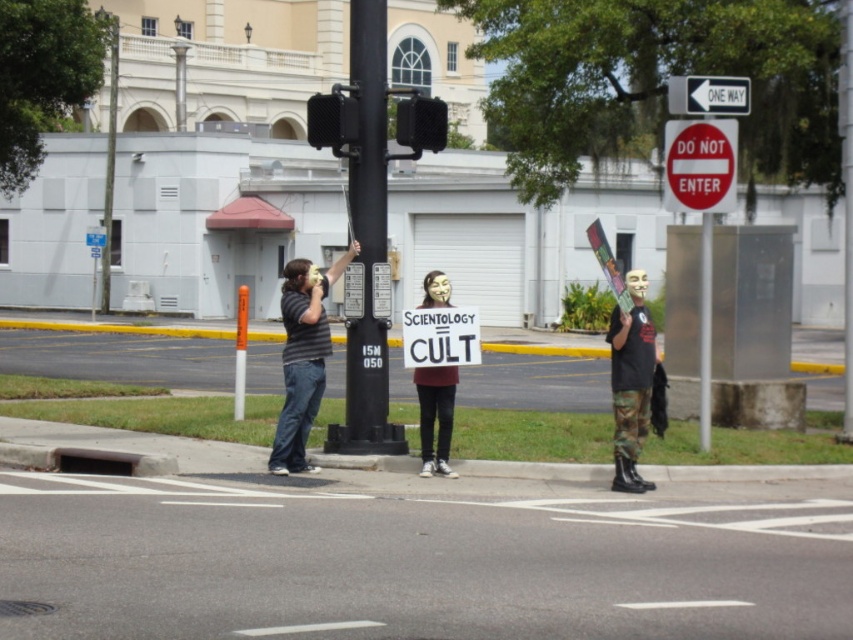
Question: Is matte black sign at center wider than black plastic traffic light at upper center?

Choices:
 (A) no
 (B) yes

Answer: (B)

Question: Is brushed metal pole at center positioned behind black plastic traffic light at upper center?

Choices:
 (A) no
 (B) yes

Answer: (A)

Question: Which point appears farthest from the camera in this image?

Choices:
 (A) (669, 131)
 (B) (457, 380)
 (C) (344, 112)
 (D) (296, 413)

Answer: (A)

Question: Is camouflage pants at center below white plastic sign at upper center?

Choices:
 (A) no
 (B) yes

Answer: (B)

Question: Considering the real-world distances, which object is closest to the camouflage pants at center?

Choices:
 (A) red matte sign at upper right
 (B) black plastic traffic light at upper center
 (C) striped shirt at center

Answer: (A)

Question: Among these points, which one is farthest from the camera?

Choices:
 (A) (616, 483)
 (B) (676, 180)
 (C) (318, 124)
 (D) (674, 99)

Answer: (B)